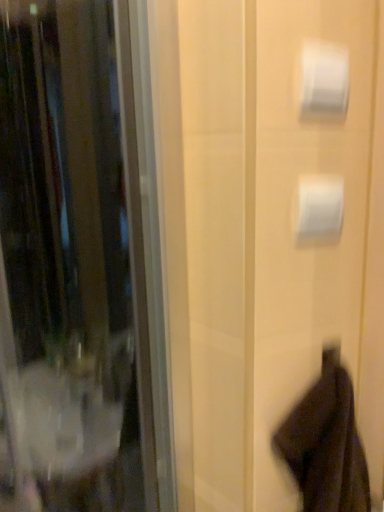
Question: Is white matte toilet paper at upper right, the second toilet paper viewed from the top, to the right of white glossy toilet paper at upper right, the second toilet paper in the bottom-to-top sequence, from the viewer's perspective?

Choices:
 (A) yes
 (B) no

Answer: (A)

Question: Is white matte toilet paper at upper right, the second toilet paper viewed from the top, beside white glossy toilet paper at upper right, the second toilet paper in the bottom-to-top sequence?

Choices:
 (A) no
 (B) yes

Answer: (A)

Question: Is white matte toilet paper at upper right, marked as the 1th toilet paper in a bottom-to-top arrangement, wider than white glossy toilet paper at upper right, the second toilet paper in the bottom-to-top sequence?

Choices:
 (A) no
 (B) yes

Answer: (A)

Question: Considering the relative sizes of white matte toilet paper at upper right, marked as the 1th toilet paper in a bottom-to-top arrangement, and white glossy toilet paper at upper right, the second toilet paper in the bottom-to-top sequence, in the image provided, is white matte toilet paper at upper right, marked as the 1th toilet paper in a bottom-to-top arrangement, taller than white glossy toilet paper at upper right, the second toilet paper in the bottom-to-top sequence,?

Choices:
 (A) no
 (B) yes

Answer: (A)

Question: Considering the relative sizes of white matte toilet paper at upper right, the second toilet paper viewed from the top, and white glossy toilet paper at upper right, the second toilet paper in the bottom-to-top sequence, in the image provided, is white matte toilet paper at upper right, the second toilet paper viewed from the top, bigger than white glossy toilet paper at upper right, the second toilet paper in the bottom-to-top sequence,?

Choices:
 (A) yes
 (B) no

Answer: (A)

Question: Considering the positions of white glossy toilet paper at upper right, which ranks as the 1th toilet paper in top-to-bottom order, and white matte toilet paper at upper right, the second toilet paper viewed from the top, in the image, is white glossy toilet paper at upper right, which ranks as the 1th toilet paper in top-to-bottom order, bigger or smaller than white matte toilet paper at upper right, the second toilet paper viewed from the top,?

Choices:
 (A) big
 (B) small

Answer: (B)

Question: Based on their positions, is white glossy toilet paper at upper right, which ranks as the 1th toilet paper in top-to-bottom order, located to the left or right of white matte toilet paper at upper right, the second toilet paper viewed from the top?

Choices:
 (A) right
 (B) left

Answer: (B)

Question: Is point (309, 56) positioned closer to the camera than point (339, 194)?

Choices:
 (A) farther
 (B) closer

Answer: (B)

Question: Is white glossy toilet paper at upper right, which ranks as the 1th toilet paper in top-to-bottom order, spatially inside white matte toilet paper at upper right, marked as the 1th toilet paper in a bottom-to-top arrangement, or outside of it?

Choices:
 (A) inside
 (B) outside

Answer: (B)

Question: Is dark brown fabric robe at lower right taller or shorter than white matte toilet paper at upper right, marked as the 1th toilet paper in a bottom-to-top arrangement?

Choices:
 (A) tall
 (B) short

Answer: (A)

Question: From the image's perspective, relative to white matte toilet paper at upper right, marked as the 1th toilet paper in a bottom-to-top arrangement, is dark brown fabric robe at lower right above or below?

Choices:
 (A) above
 (B) below

Answer: (B)

Question: Is dark brown fabric robe at lower right to the left or to the right of white matte toilet paper at upper right, the second toilet paper viewed from the top, in the image?

Choices:
 (A) right
 (B) left

Answer: (A)

Question: Which is correct: dark brown fabric robe at lower right is inside white matte toilet paper at upper right, marked as the 1th toilet paper in a bottom-to-top arrangement, or outside of it?

Choices:
 (A) inside
 (B) outside

Answer: (B)

Question: In terms of width, does dark brown fabric robe at lower right look wider or thinner when compared to white glossy toilet paper at upper right, the second toilet paper in the bottom-to-top sequence?

Choices:
 (A) thin
 (B) wide

Answer: (B)

Question: From the image's perspective, is dark brown fabric robe at lower right positioned above or below white glossy toilet paper at upper right, the second toilet paper in the bottom-to-top sequence?

Choices:
 (A) above
 (B) below

Answer: (B)